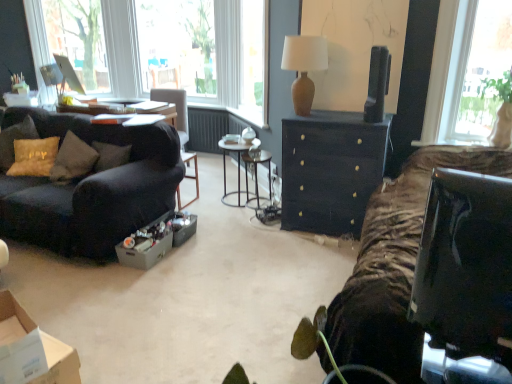
Question: Can you confirm if black glossy television at upper right is positioned to the right of zebra-patterned fabric at right?

Choices:
 (A) yes
 (B) no

Answer: (A)

Question: Can you confirm if black glossy television at upper right is thinner than zebra-patterned fabric at right?

Choices:
 (A) no
 (B) yes

Answer: (B)

Question: From the image's perspective, is black glossy television at upper right located beneath zebra-patterned fabric at right?

Choices:
 (A) yes
 (B) no

Answer: (B)

Question: Can you confirm if black glossy television at upper right is bigger than zebra-patterned fabric at right?

Choices:
 (A) yes
 (B) no

Answer: (B)

Question: Is black glossy television at upper right to the left of zebra-patterned fabric at right from the viewer's perspective?

Choices:
 (A) yes
 (B) no

Answer: (B)

Question: Looking at their shapes, would you say brown cardboard box at lower left is wider or thinner than black glossy television at upper right?

Choices:
 (A) wide
 (B) thin

Answer: (A)

Question: From their relative heights in the image, would you say brown cardboard box at lower left is taller or shorter than black glossy television at upper right?

Choices:
 (A) short
 (B) tall

Answer: (A)

Question: Does point (31, 382) appear closer or farther from the camera than point (386, 52)?

Choices:
 (A) farther
 (B) closer

Answer: (B)

Question: From the image's perspective, is brown cardboard box at lower left positioned above or below black glossy television at upper right?

Choices:
 (A) above
 (B) below

Answer: (B)

Question: From the image's perspective, is metallic silver side table at center above or below velvet dark brown couch at left?

Choices:
 (A) above
 (B) below

Answer: (A)

Question: Relative to velvet dark brown couch at left, is metallic silver side table at center in front or behind?

Choices:
 (A) behind
 (B) front

Answer: (A)

Question: Considering the positions of metallic silver side table at center and velvet dark brown couch at left in the image, is metallic silver side table at center taller or shorter than velvet dark brown couch at left?

Choices:
 (A) short
 (B) tall

Answer: (A)

Question: From a real-world perspective, is metallic silver side table at center positioned above or below velvet dark brown couch at left?

Choices:
 (A) above
 (B) below

Answer: (B)

Question: From the image's perspective, is gold textured pillow at left above or below matte gray cardboard box at center?

Choices:
 (A) below
 (B) above

Answer: (B)

Question: Do you think gold textured pillow at left is within matte gray cardboard box at center, or outside of it?

Choices:
 (A) inside
 (B) outside

Answer: (B)